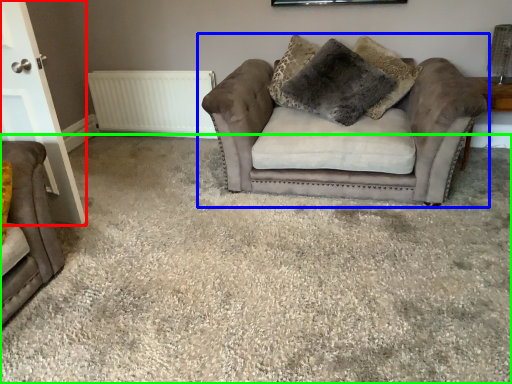
Question: Based on their relative distances, which object is farther from door (highlighted by a red box)? Choose from studio couch (highlighted by a blue box) and plain (highlighted by a green box).

Choices:
 (A) studio couch
 (B) plain

Answer: (A)